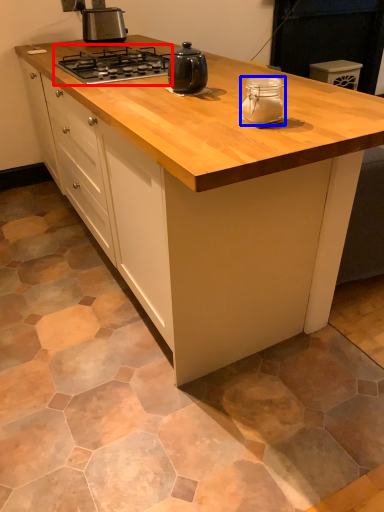
Question: Which object is further to the camera taking this photo, gas stove (highlighted by a red box) or kitchen appliance (highlighted by a blue box)?

Choices:
 (A) gas stove
 (B) kitchen appliance

Answer: (A)